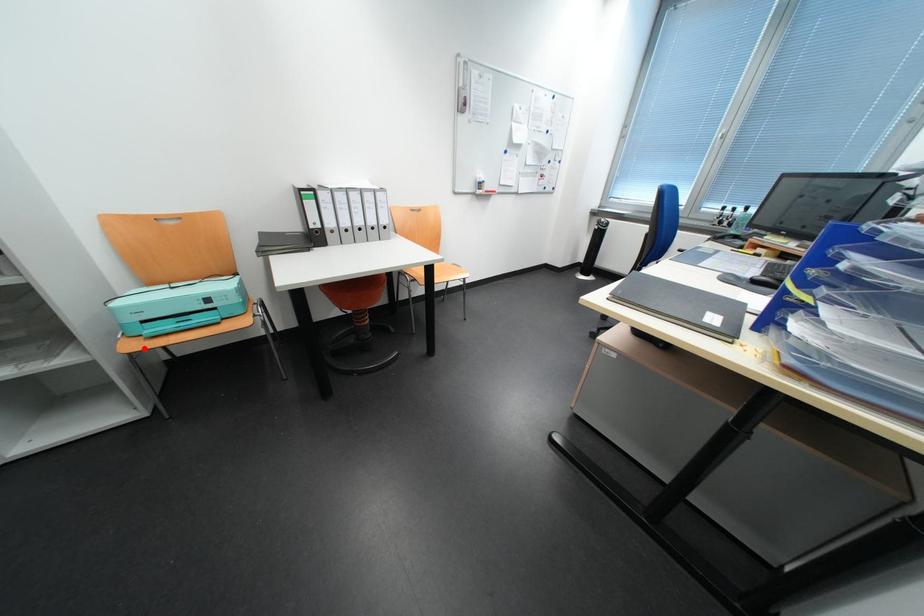
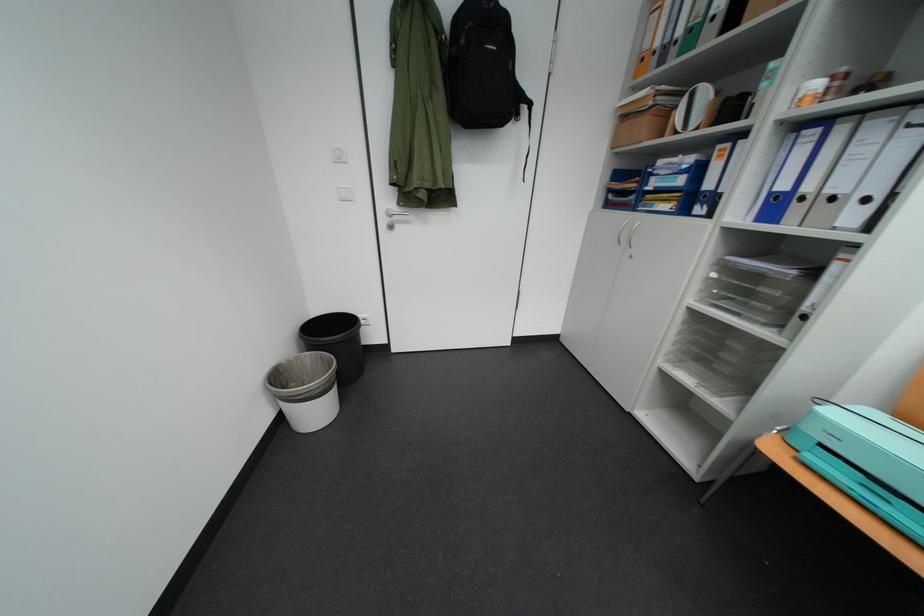
The point at the highlighted location is marked in the first image. Where is the corresponding point in the second image?

(784, 451)